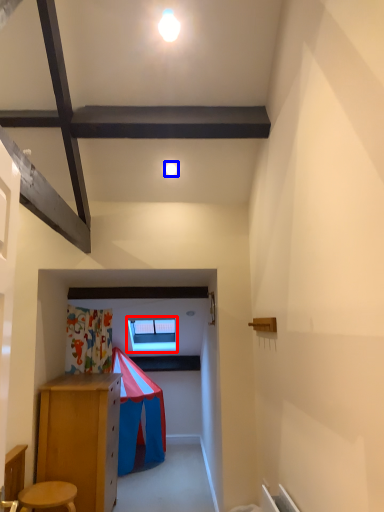
Question: Which object appears closest to the camera in this image, window (highlighted by a red box) or light (highlighted by a blue box)?

Choices:
 (A) window
 (B) light

Answer: (B)